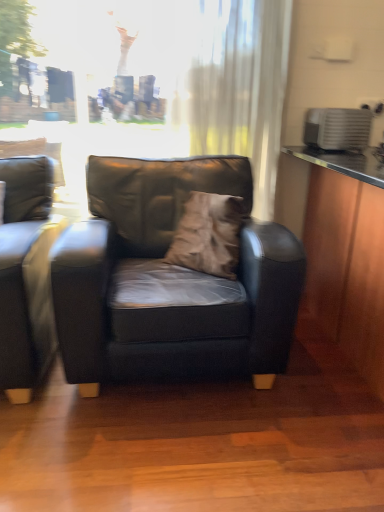
Question: Could matte black chair at center be considered to be inside brown suede pillow at center?

Choices:
 (A) yes
 (B) no

Answer: (B)

Question: Can you confirm if brown suede pillow at center is taller than matte black chair at center?

Choices:
 (A) yes
 (B) no

Answer: (B)

Question: Can you confirm if brown suede pillow at center is shorter than matte black chair at center?

Choices:
 (A) no
 (B) yes

Answer: (B)

Question: Considering the relative positions of brown suede pillow at center and matte black chair at center in the image provided, is brown suede pillow at center to the left of matte black chair at center from the viewer's perspective?

Choices:
 (A) no
 (B) yes

Answer: (A)

Question: Is the depth of brown suede pillow at center greater than that of matte black chair at center?

Choices:
 (A) no
 (B) yes

Answer: (B)

Question: From a real-world perspective, is matte black couch at left above or below white sheer curtain at upper center?

Choices:
 (A) below
 (B) above

Answer: (A)

Question: Would you say matte black couch at left is to the left or to the right of white sheer curtain at upper center in the picture?

Choices:
 (A) right
 (B) left

Answer: (B)

Question: From the image's perspective, is matte black couch at left above or below white sheer curtain at upper center?

Choices:
 (A) above
 (B) below

Answer: (B)

Question: Considering the positions of point (44, 280) and point (266, 76), is point (44, 280) closer or farther from the camera than point (266, 76)?

Choices:
 (A) farther
 (B) closer

Answer: (B)

Question: In the image, is brown suede pillow at center on the left side or the right side of matte black chair at center?

Choices:
 (A) right
 (B) left

Answer: (A)

Question: Considering the positions of brown suede pillow at center and matte black chair at center in the image, is brown suede pillow at center taller or shorter than matte black chair at center?

Choices:
 (A) tall
 (B) short

Answer: (B)

Question: Is brown suede pillow at center bigger or smaller than matte black chair at center?

Choices:
 (A) big
 (B) small

Answer: (B)

Question: From a real-world perspective, is brown suede pillow at center above or below matte black chair at center?

Choices:
 (A) below
 (B) above

Answer: (B)

Question: Is point (278, 279) closer or farther from the camera than point (31, 340)?

Choices:
 (A) farther
 (B) closer

Answer: (B)

Question: From a real-world perspective, is matte black chair at center above or below matte black couch at left?

Choices:
 (A) above
 (B) below

Answer: (B)